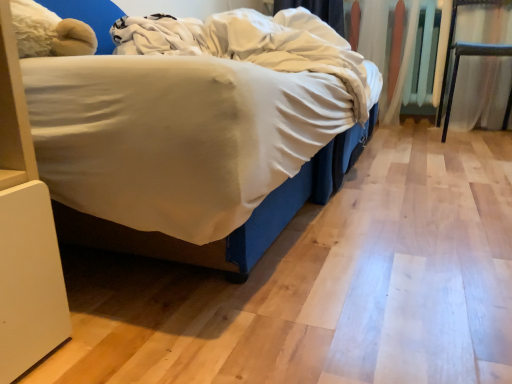
Question: Is point (485, 46) positioned closer to the camera than point (152, 48)?

Choices:
 (A) closer
 (B) farther

Answer: (B)

Question: From a real-world perspective, is metallic silver chair at right positioned above or below white soft blanket at center?

Choices:
 (A) below
 (B) above

Answer: (A)

Question: From the image's perspective, is metallic silver chair at right above or below white soft blanket at center?

Choices:
 (A) below
 (B) above

Answer: (B)

Question: Is white soft blanket at center spatially inside metallic silver chair at right, or outside of it?

Choices:
 (A) inside
 (B) outside

Answer: (B)

Question: From a real-world perspective, is white soft blanket at center above or below metallic silver chair at right?

Choices:
 (A) below
 (B) above

Answer: (B)

Question: Is white soft blanket at center taller or shorter than metallic silver chair at right?

Choices:
 (A) tall
 (B) short

Answer: (B)

Question: From the image's perspective, relative to metallic silver chair at right, is white soft blanket at center above or below?

Choices:
 (A) above
 (B) below

Answer: (B)